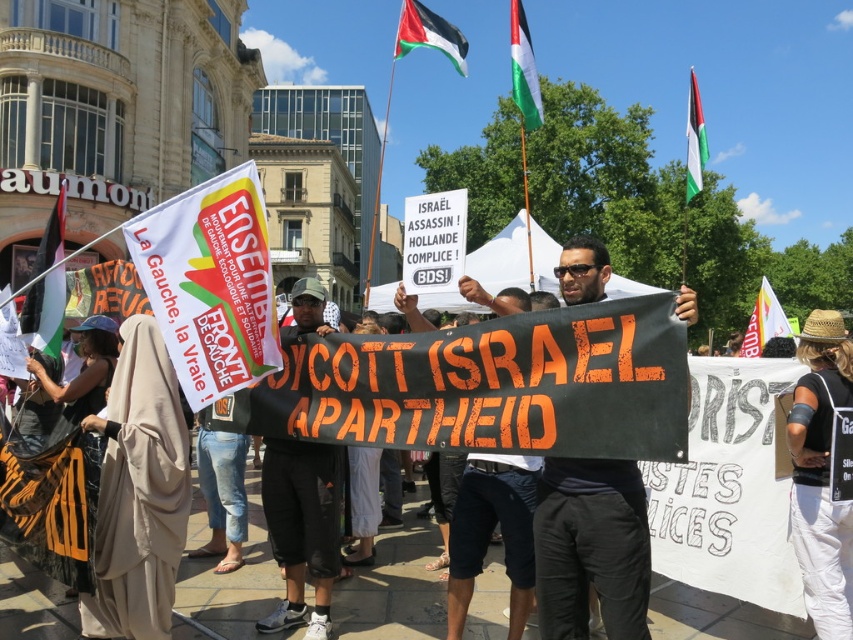
You are a photographer at the protest scene. You want to capture a photo of the beige fabric headscarf at lower left. Based on its coordinates, where should you aim your camera?

The beige fabric headscarf at lower left is located at point (138,492), so you should aim your camera at that coordinate to capture it.